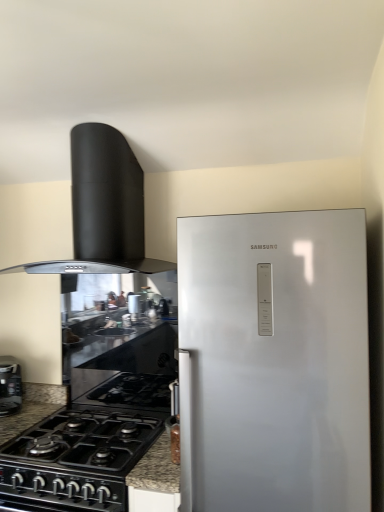
Question: Is point (11, 393) closer or farther from the camera than point (104, 504)?

Choices:
 (A) farther
 (B) closer

Answer: (A)

Question: In terms of width, does black glossy toaster at lower left look wider or thinner when compared to black matte/glossy gas stove at lower left?

Choices:
 (A) thin
 (B) wide

Answer: (A)

Question: Which is nearer to the black glass countertop at center?

Choices:
 (A) black matte/glossy gas stove at lower left
 (B) black matte range hood at upper left
 (C) black glossy toaster at lower left

Answer: (A)

Question: Which of these objects is positioned farthest from the black matte range hood at upper left?

Choices:
 (A) black matte/glossy gas stove at lower left
 (B) black glass countertop at center
 (C) black glossy toaster at lower left

Answer: (C)